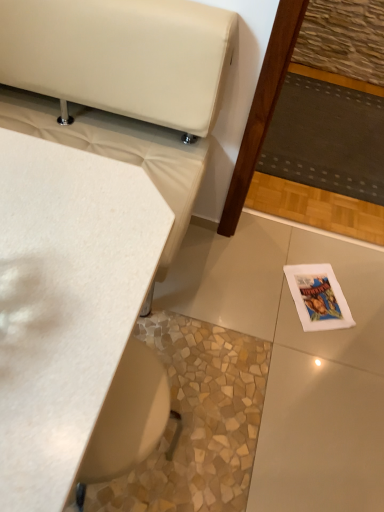
The height and width of the screenshot is (512, 384). What are the coordinates of `free area behind white paper magazine at lower right` in the screenshot? It's located at (317, 251).